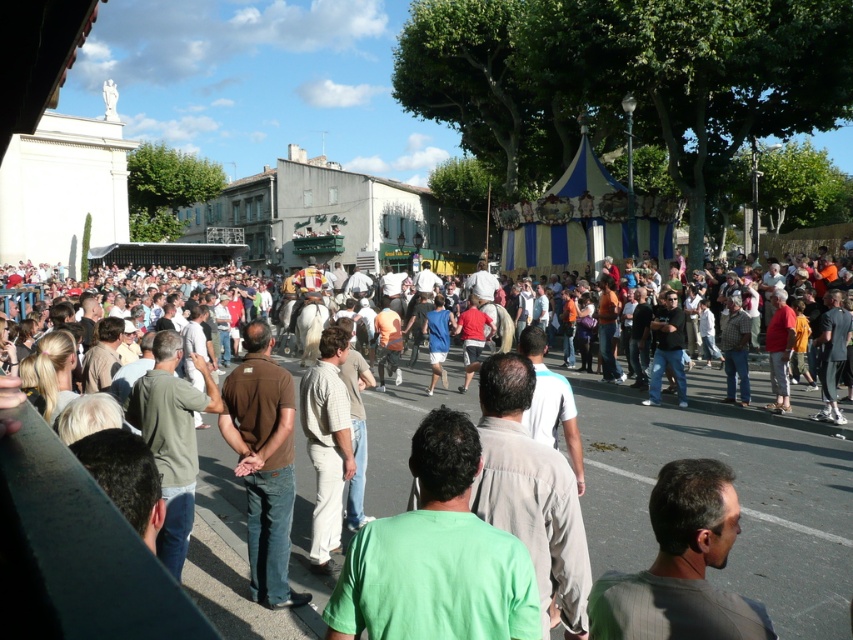
Question: Does light brown casual clothing at center appear on the right side of light beige pants at center?

Choices:
 (A) no
 (B) yes

Answer: (A)

Question: Can you confirm if green matte shirt at center is positioned to the right of gray fabric shirt at lower right?

Choices:
 (A) yes
 (B) no

Answer: (B)

Question: Which of the following is the farthest from the observer?

Choices:
 (A) light beige pants at center
 (B) light brown casual clothing at center
 (C) gray fabric shirt at lower right

Answer: (A)

Question: Among these objects, which one is nearest to the camera?

Choices:
 (A) light beige pants at center
 (B) green matte shirt at center
 (C) light brown casual clothing at center

Answer: (B)

Question: Does gray fabric shirt at lower right appear over brown cotton shirt at center?

Choices:
 (A) yes
 (B) no

Answer: (B)

Question: Which of these objects is positioned closest to the light brown casual clothing at center?

Choices:
 (A) green matte shirt at center
 (B) light beige pants at center
 (C) gray fabric shirt at lower right

Answer: (B)